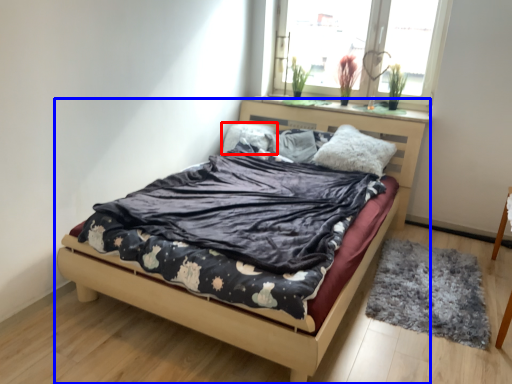
Question: Which of the following is the closest to the observer, pillow (highlighted by a red box) or bed (highlighted by a blue box)?

Choices:
 (A) pillow
 (B) bed

Answer: (B)